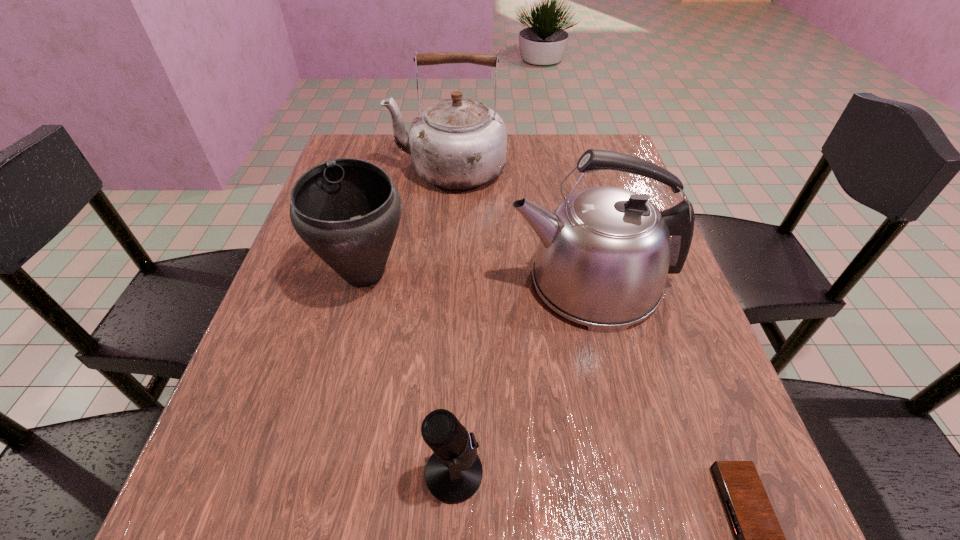
Identify the location of the farthest object. (458, 143).

Find the location of a particular element. This screenshot has height=540, width=960. the nearer kettle is located at coordinates (604, 254).

The image size is (960, 540). What are the coordinates of `the third tallest object` in the screenshot? It's located at (347, 210).

Identify the location of microphone. (453, 474).

I want to click on free space located at the spout of the farthest object, so click(332, 169).

The height and width of the screenshot is (540, 960). What are the coordinates of `vacant space located 0.140m at the spout of the farthest object` in the screenshot? It's located at (339, 169).

This screenshot has width=960, height=540. I want to click on free space located 0.090m at the spout of the farthest object, so click(x=358, y=169).

In order to click on free spot located 0.240m on the spout of the nearer kettle in this screenshot , I will do `click(391, 282)`.

Find the location of `free region located 0.110m on the spout of the nearer kettle`. free region located 0.110m on the spout of the nearer kettle is located at coordinates (454, 282).

Find the location of `free space located 0.320m on the spout of the nearer kettle`. free space located 0.320m on the spout of the nearer kettle is located at coordinates (352, 282).